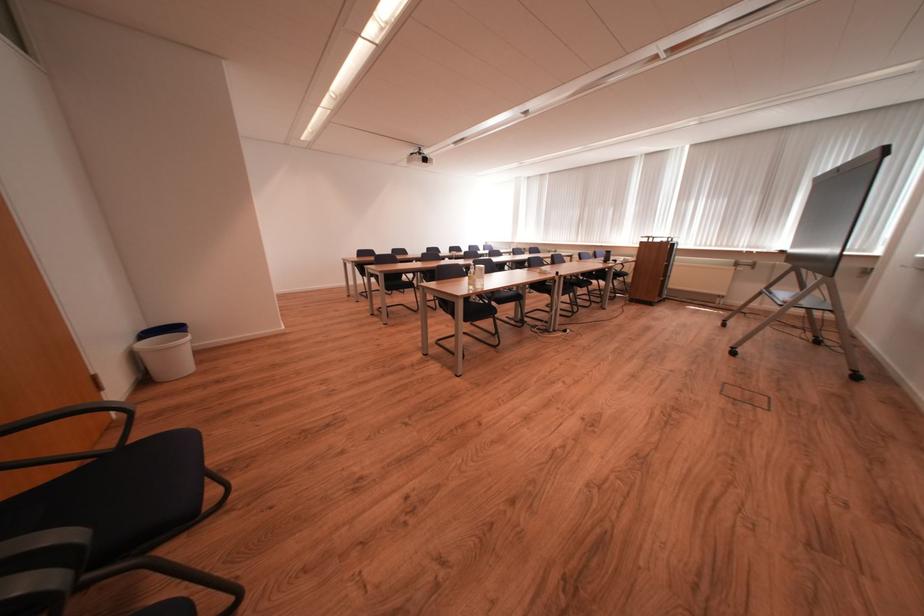
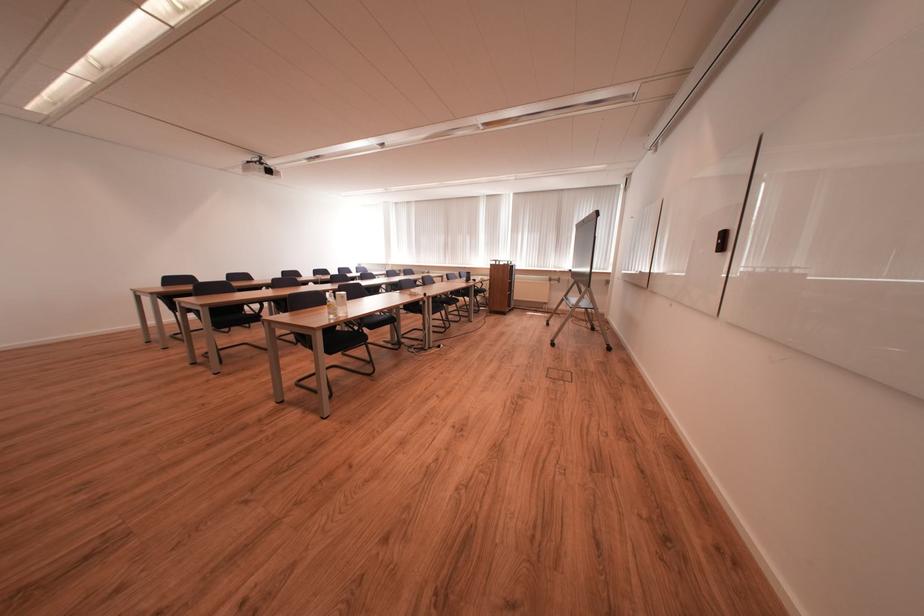
Locate, in the second image, the point that corresponds to pixel 483 283 in the first image.

(344, 310)